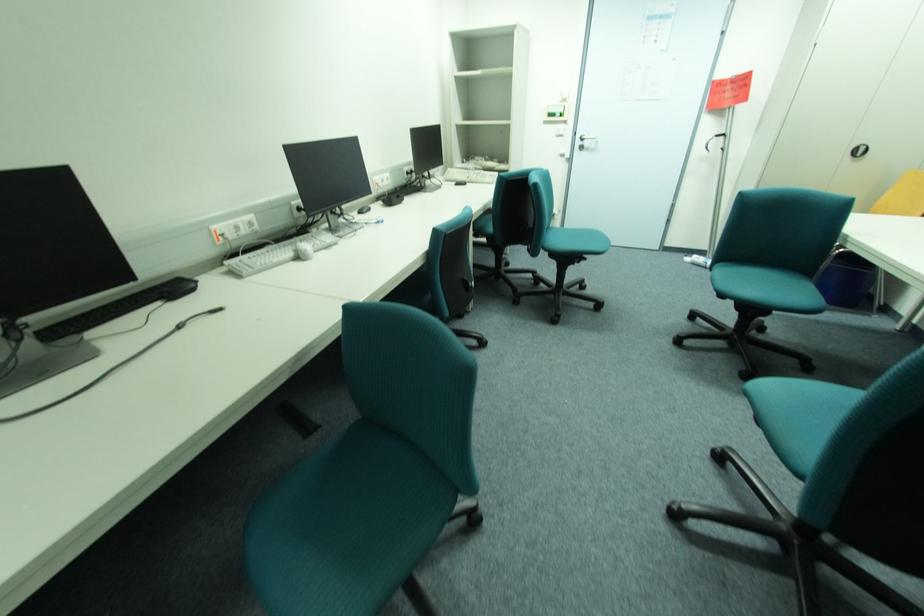
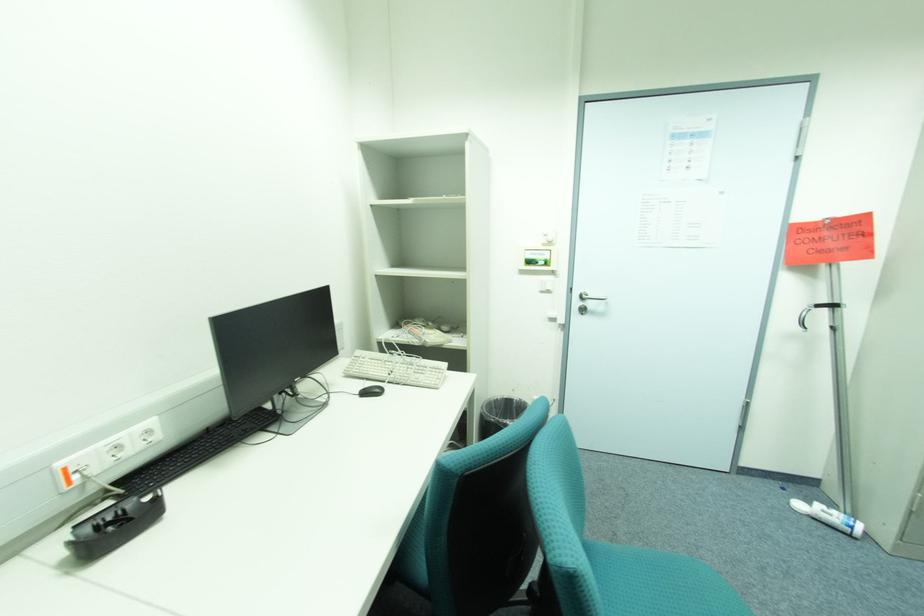
Question: In a continuous first-person perspective shot, in which direction is the camera moving?

Choices:
 (A) Left
 (B) Right
 (C) Forward
 (D) Backward

Answer: (C)